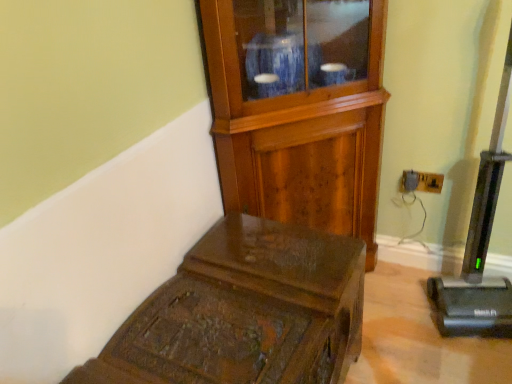
Question: From a real-world perspective, does wooden side cabinet at center stand above black plastic vacuum cleaner at right?

Choices:
 (A) no
 (B) yes

Answer: (B)

Question: Considering the relative positions of wooden side cabinet at center and black plastic vacuum cleaner at right in the image provided, is wooden side cabinet at center in front of black plastic vacuum cleaner at right?

Choices:
 (A) no
 (B) yes

Answer: (A)

Question: Considering the relative sizes of wooden side cabinet at center and black plastic vacuum cleaner at right in the image provided, is wooden side cabinet at center taller than black plastic vacuum cleaner at right?

Choices:
 (A) no
 (B) yes

Answer: (A)

Question: Is wooden side cabinet at center not within black plastic vacuum cleaner at right?

Choices:
 (A) no
 (B) yes

Answer: (B)

Question: Does wooden side cabinet at center have a lesser width compared to black plastic vacuum cleaner at right?

Choices:
 (A) no
 (B) yes

Answer: (A)

Question: Relative to wooden side cabinet at center, is wooden trunk at lower left in front or behind?

Choices:
 (A) behind
 (B) front

Answer: (B)

Question: Is wooden trunk at lower left bigger or smaller than wooden side cabinet at center?

Choices:
 (A) small
 (B) big

Answer: (A)

Question: From the image's perspective, is wooden trunk at lower left above or below wooden side cabinet at center?

Choices:
 (A) above
 (B) below

Answer: (B)

Question: From a real-world perspective, is wooden trunk at lower left above or below wooden side cabinet at center?

Choices:
 (A) above
 (B) below

Answer: (B)

Question: From a real-world perspective, relative to wooden trunk at lower left, is black plastic vacuum cleaner at right vertically above or below?

Choices:
 (A) below
 (B) above

Answer: (B)

Question: From the image's perspective, is black plastic vacuum cleaner at right located above or below wooden trunk at lower left?

Choices:
 (A) above
 (B) below

Answer: (A)

Question: Do you think black plastic vacuum cleaner at right is within wooden trunk at lower left, or outside of it?

Choices:
 (A) inside
 (B) outside

Answer: (B)

Question: Is black plastic vacuum cleaner at right to the left or to the right of wooden trunk at lower left in the image?

Choices:
 (A) right
 (B) left

Answer: (A)

Question: From their relative heights in the image, would you say wooden trunk at lower left is taller or shorter than black plastic vacuum cleaner at right?

Choices:
 (A) tall
 (B) short

Answer: (B)

Question: In the image, is wooden trunk at lower left positioned in front of or behind black plastic vacuum cleaner at right?

Choices:
 (A) front
 (B) behind

Answer: (A)